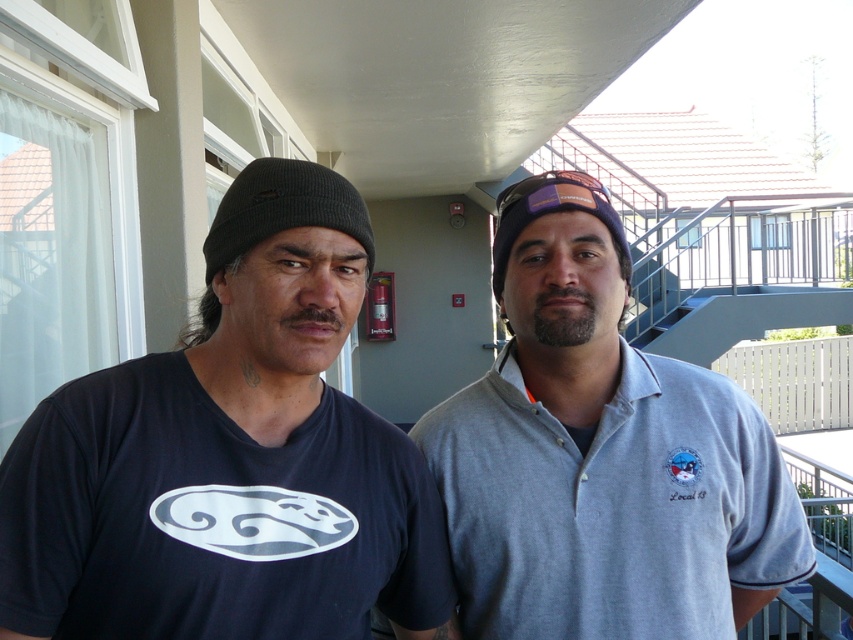
In the scene shown: Does gray cotton polo shirt at center have a smaller size compared to black knit cap at left?

Incorrect, gray cotton polo shirt at center is not smaller in size than black knit cap at left.

Find the location of a particular element. gray cotton polo shirt at center is located at coordinates (601, 454).

Can you confirm if black knit cap at left is positioned above purple fabric cap at center?

No.

Is point (260, 216) behind point (547, 211)?

No, (260, 216) is in front of (547, 211).

Between point (206, 269) and point (544, 202), which one is positioned in front?

Point (206, 269) is more forward.

In order to click on black knit cap at left in this screenshot , I will do `click(283, 209)`.

Which of these two, dark blue t-shirt at left or black knit cap at left, stands shorter?

With less height is black knit cap at left.

Which of these two, dark blue t-shirt at left or black knit cap at left, stands taller?

With more height is dark blue t-shirt at left.

At what (x,y) coordinates should I click in order to perform the action: click on dark blue t-shirt at left. Please return your answer as a coordinate pair (x, y). This screenshot has width=853, height=640. Looking at the image, I should click on (230, 458).

Where is `dark blue t-shirt at left`? Image resolution: width=853 pixels, height=640 pixels. dark blue t-shirt at left is located at coordinates (230, 458).